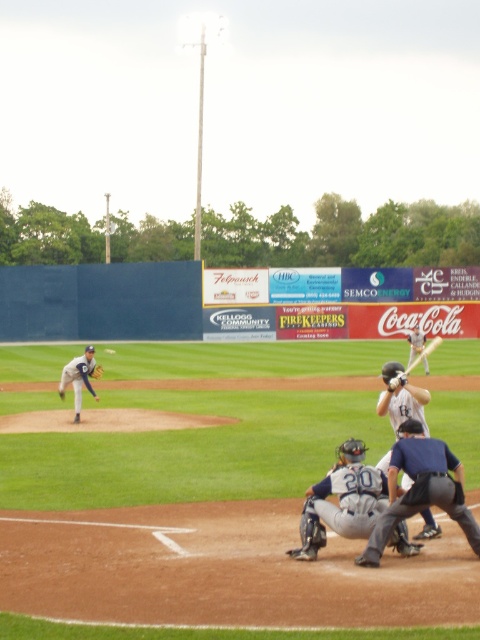
Question: Which object is the closest to the gray uniformed pitcher at left?

Choices:
 (A) dark gray leather glove at center
 (B) gray matte catcher at center
 (C) matte white bat at center

Answer: (A)

Question: Can you confirm if dark blue uniform at center is positioned to the left of gray matte catcher at center?

Choices:
 (A) no
 (B) yes

Answer: (A)

Question: Does dark blue uniform at center have a lesser width compared to dark gray leather glove at center?

Choices:
 (A) no
 (B) yes

Answer: (A)

Question: Which point appears closest to the camera in this image?

Choices:
 (A) coord(420,452)
 (B) coord(373,490)
 (C) coord(73,372)

Answer: (A)

Question: Can you confirm if gray uniformed pitcher at left is wider than matte gray helmet at center?

Choices:
 (A) yes
 (B) no

Answer: (B)

Question: Which of these objects is positioned farthest from the gray matte catcher at center?

Choices:
 (A) matte white bat at center
 (B) dark gray leather glove at center
 (C) gray uniformed pitcher at left

Answer: (B)